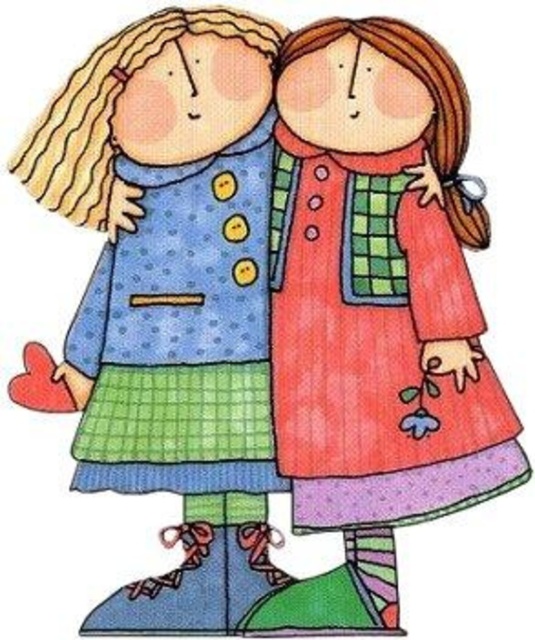
Question: Among these points, which one is nearest to the camera?

Choices:
 (A) (154, 83)
 (B) (473, 227)

Answer: (A)

Question: Among these points, which one is farthest from the camera?

Choices:
 (A) (263, 308)
 (B) (388, 554)

Answer: (A)

Question: From the image, what is the correct spatial relationship of matte pink dress at right in relation to matte blue dress at left?

Choices:
 (A) below
 (B) above

Answer: (A)

Question: Which of the following is the closest to the observer?

Choices:
 (A) (186, 545)
 (B) (501, 465)

Answer: (B)

Question: Is matte pink dress at right above matte blue dress at left?

Choices:
 (A) no
 (B) yes

Answer: (A)

Question: Can you confirm if matte pink dress at right is smaller than matte blue dress at left?

Choices:
 (A) no
 (B) yes

Answer: (B)